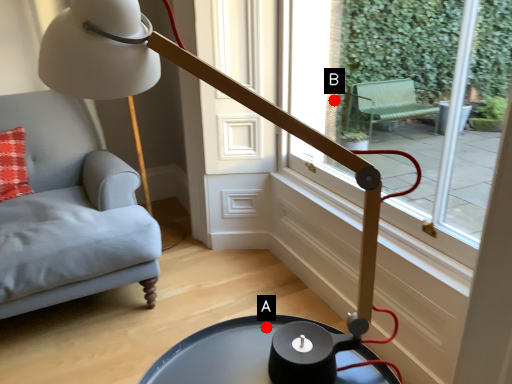
Question: Two points are circled on the image, labeled by A and B beside each circle. Which point is closer to the camera taking this photo?

Choices:
 (A) A is closer
 (B) B is closer

Answer: (A)